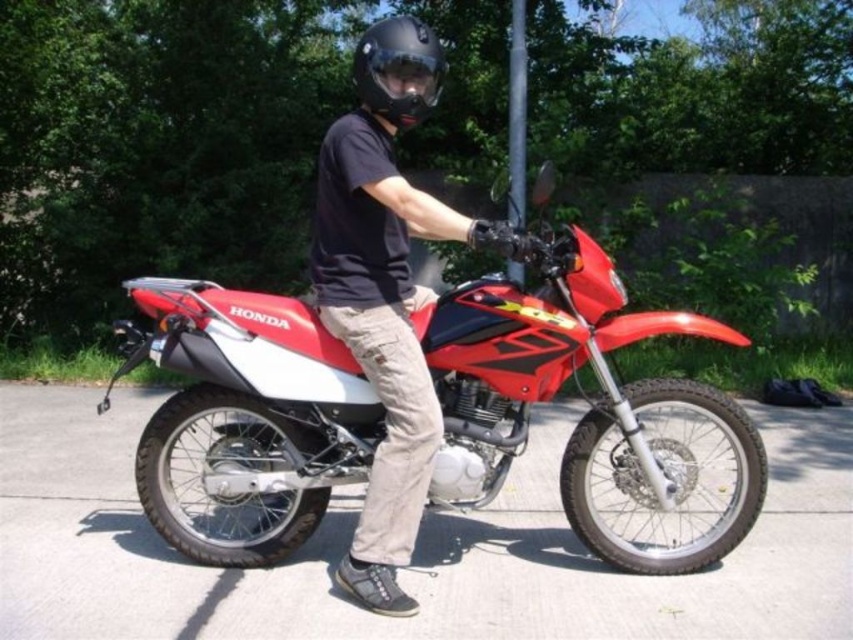
You are a safety inspector checking the gear of a motorcycle rider. You notice the rider has both the matte black helmet at center and the matte black goggles at center. According to safety regulations, the goggles must be positioned within 15 inches of the helmet to ensure proper visibility and protection. Is the current placement of the goggles compliant with this requirement?

The matte black helmet at center is 16.51 inches away from the matte black goggles at center, which exceeds the 15 inches requirement. Therefore, the goggles are not compliant with the safety regulations.

You are a safety inspector checking the equipment of a motorcycle rider. You notice two items on the rider at center. Which item is narrower between the black matte helmet at center and the matte black goggles at center?

The black matte helmet at center is narrower than the matte black goggles at center.